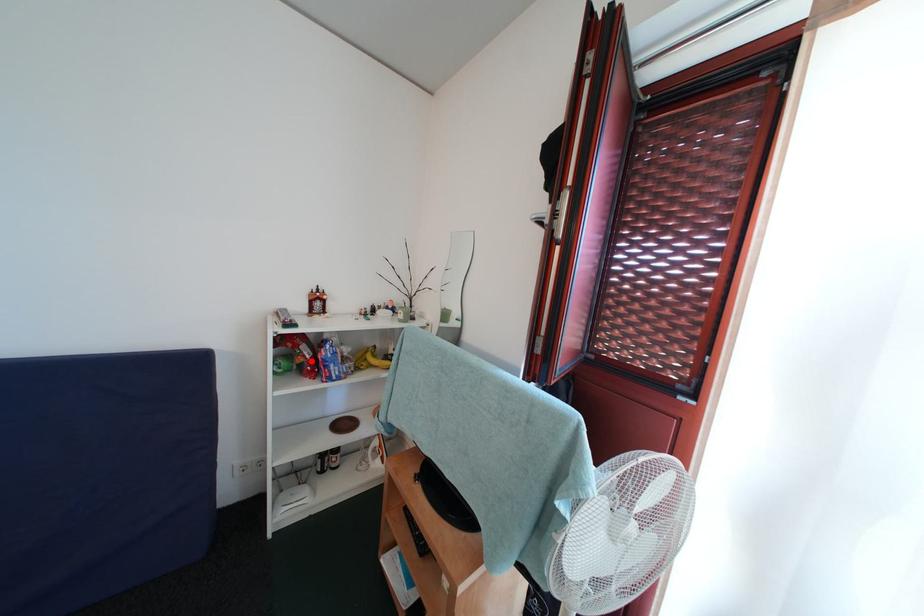
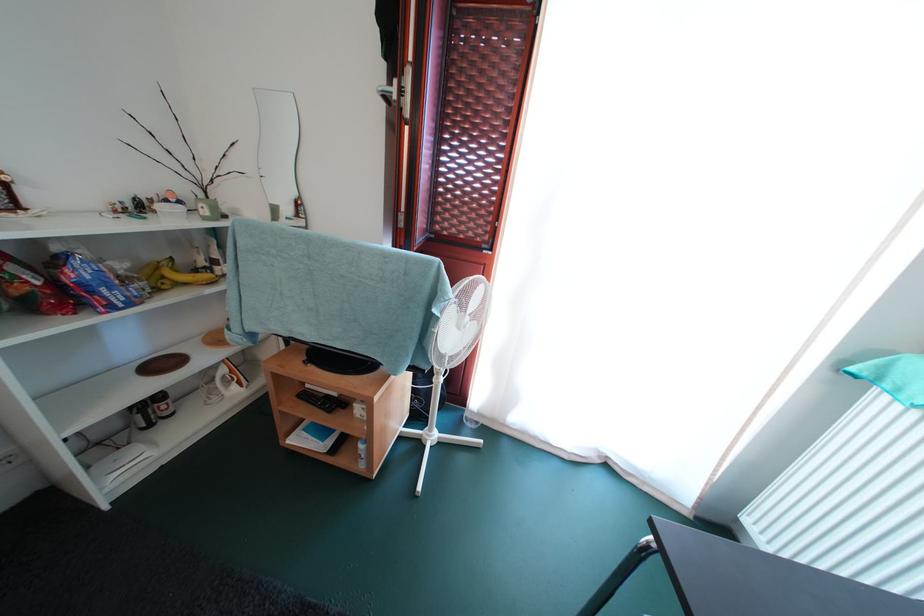
Where in the second image is the point corresponding to the highlighted location from the first image?

(34, 286)